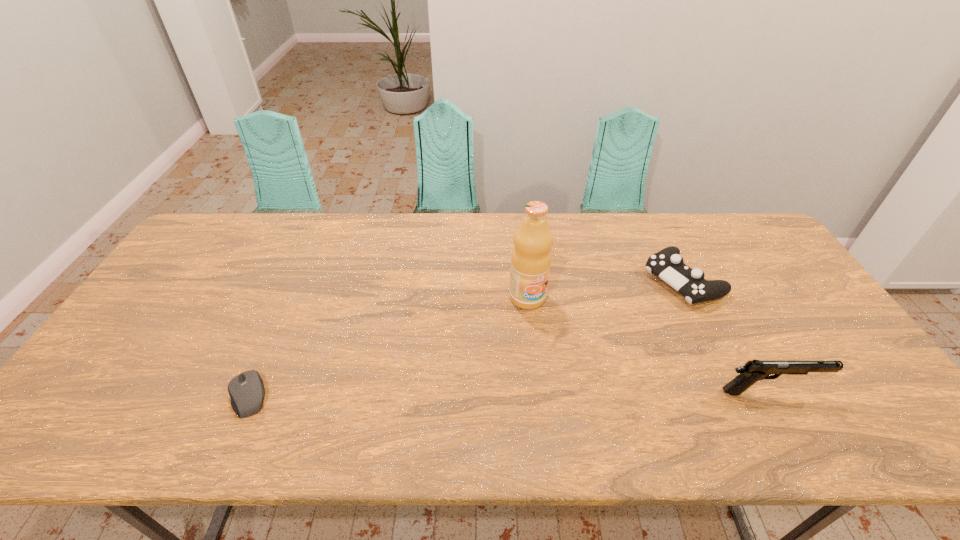
You are a GUI agent. You are given a task and a screenshot of the screen. Output one action in this format:
    pyautogui.click(x=<x>, y=<y>)
    Task: Click on the shortest object
    
    Given the screenshot: What is the action you would take?
    (x=246, y=390)

Where is `the leftmost object`? The height and width of the screenshot is (540, 960). the leftmost object is located at coordinates (246, 390).

Where is `gun`? This screenshot has height=540, width=960. gun is located at coordinates (754, 370).

What are the coordinates of `fruit juice` in the screenshot? It's located at (531, 258).

This screenshot has height=540, width=960. What are the coordinates of `the second object from left to right` in the screenshot? It's located at click(531, 258).

Where is `the second shortest object`? This screenshot has height=540, width=960. the second shortest object is located at coordinates (667, 264).

Locate an element on the screen. free space located 0.060m on the right of the shortest object is located at coordinates (295, 395).

In order to click on vacant space located 0.090m at the aiming end of the third shortest object in this screenshot , I will do `click(853, 392)`.

I want to click on vacant space located on the front label of the fruit juice, so click(x=589, y=398).

You are a GUI agent. You are given a task and a screenshot of the screen. Output one action in this format:
    pyautogui.click(x=<x>, y=<y>)
    Task: Click on the vacant space situated 0.110m on the front label of the fruit juice
    
    Given the screenshot: What is the action you would take?
    pyautogui.click(x=553, y=339)